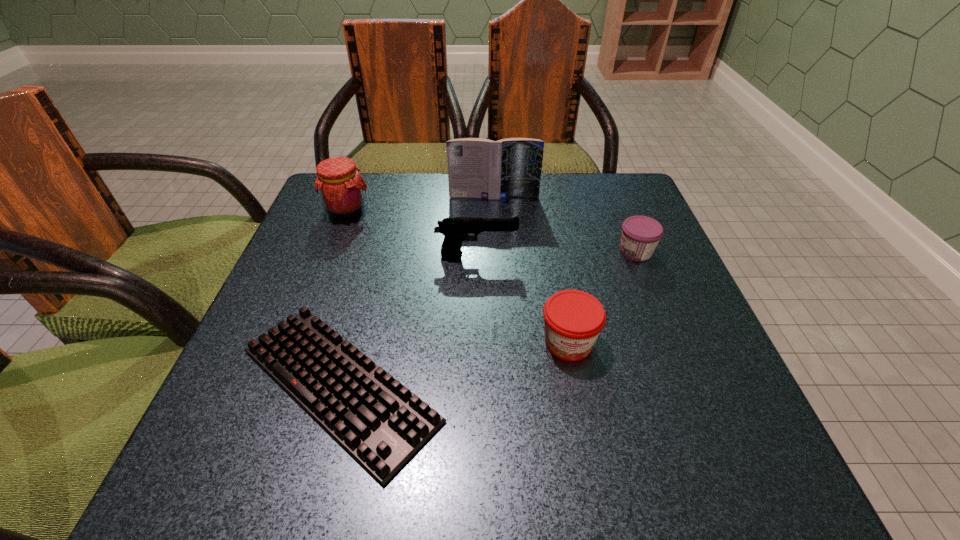
Locate an element on the screen. the tallest object is located at coordinates coord(479,168).

Where is `the farthest jam`? the farthest jam is located at coordinates (341, 188).

Locate an element on the screen. This screenshot has width=960, height=540. the second tallest object is located at coordinates (341, 188).

Find the location of `pistol`. pistol is located at coordinates (455, 230).

At what (x,y) coordinates should I click in order to perform the action: click on the second shortest jam. Please return your answer as a coordinate pair (x, y). This screenshot has width=960, height=540. Looking at the image, I should click on (573, 319).

Locate an element on the screen. the nearest jam is located at coordinates (573, 319).

Where is `the fifth tallest object`? the fifth tallest object is located at coordinates (640, 236).

The image size is (960, 540). Find the location of `the shortest jam`. the shortest jam is located at coordinates (640, 236).

Where is `computer keyboard`? The image size is (960, 540). computer keyboard is located at coordinates (381, 423).

Image resolution: width=960 pixels, height=540 pixels. Find the location of `free space located 0.050m on the front cover of the tallest object`. free space located 0.050m on the front cover of the tallest object is located at coordinates (494, 211).